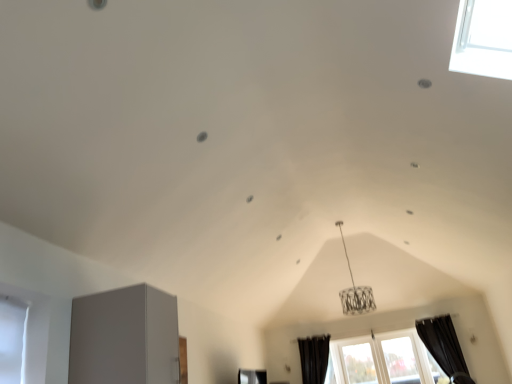
In order to face transparent glass window at lower right, acting as the first window starting from the right, should I rotate leftwards or rightwards?

You should rotate right by 18.556 degrees.

At what (x,y) coordinates should I click in order to perform the action: click on white glass window at lower right, which is counted as the second window, starting from the right. Please return your answer as a coordinate pair (x, y). The width and height of the screenshot is (512, 384). Looking at the image, I should click on (383, 360).

This screenshot has width=512, height=384. Identify the location of transparent glass window at lower right, the second window viewed from the left. (401, 360).

Is black fabric curtain at lower right, the 1th curtain from the right, positioned with its back to transparent glass window at lower right, the second window viewed from the left?

No, black fabric curtain at lower right, the 1th curtain from the right, is not facing the opposite direction of transparent glass window at lower right, the second window viewed from the left.

From a real-world perspective, is black fabric curtain at lower right, the 2th curtain positioned from the left, under transparent glass window at lower right, acting as the first window starting from the right?

Incorrect, from a real-world perspective, black fabric curtain at lower right, the 2th curtain positioned from the left, is higher than transparent glass window at lower right, acting as the first window starting from the right.

Which of these two, black fabric curtain at lower right, the 1th curtain from the right, or transparent glass window at lower right, the second window viewed from the left, stands taller?

Standing taller between the two is black fabric curtain at lower right, the 1th curtain from the right.

Which object is further away from the camera taking this photo, black fabric curtain at lower right, the 1th curtain from the right, or transparent glass window at lower right, acting as the first window starting from the right?

transparent glass window at lower right, acting as the first window starting from the right, is more distant.

Could you measure the distance between transparent glass window at lower right, the second window viewed from the left, and white glass window at lower right, which is the first window from left to right?

transparent glass window at lower right, the second window viewed from the left, and white glass window at lower right, which is the first window from left to right, are 20.13 centimeters apart from each other.

Which is behind, point (389, 353) or point (392, 344)?

The point (392, 344) is behind.

From the image's perspective, is transparent glass window at lower right, the second window viewed from the left, located above or below white glass window at lower right, which is the first window from left to right?

transparent glass window at lower right, the second window viewed from the left, is above white glass window at lower right, which is the first window from left to right.

Are transparent glass window at lower right, the second window viewed from the left, and white glass window at lower right, which is counted as the second window, starting from the right, making contact?

transparent glass window at lower right, the second window viewed from the left, and white glass window at lower right, which is counted as the second window, starting from the right, are not in contact.

Are black fabric curtain at lower center, the 1th curtain when ordered from left to right, and white glass window at lower right, which is the first window from left to right, located far from each other?

No, there isn't a large distance between black fabric curtain at lower center, the 1th curtain when ordered from left to right, and white glass window at lower right, which is the first window from left to right.

From a real-world perspective, starting from the black fabric curtain at lower center, placed as the 2th curtain when sorted from right to left, which window is the 2nd one below it? Please provide its 2D coordinates.

[(383, 360)]

From a real-world perspective, is black fabric curtain at lower center, placed as the 2th curtain when sorted from right to left, positioned over white glass window at lower right, which is the first window from left to right, based on gravity?

Yes, from a real-world perspective, black fabric curtain at lower center, placed as the 2th curtain when sorted from right to left, is over white glass window at lower right, which is the first window from left to right

How many degrees apart are the facing directions of black fabric curtain at lower center, placed as the 2th curtain when sorted from right to left, and white glass window at lower right, which is counted as the second window, starting from the right?

0.728 degrees.

Considering the relative positions of white glass window at lower right, which is the first window from left to right, and transparent glass window at lower right, acting as the first window starting from the right, in the image provided, is white glass window at lower right, which is the first window from left to right, to the left of transparent glass window at lower right, acting as the first window starting from the right, from the viewer's perspective?

Indeed, white glass window at lower right, which is the first window from left to right, is positioned on the left side of transparent glass window at lower right, acting as the first window starting from the right.

Consider the image. From the image's perspective, which one is positioned lower, white glass window at lower right, which is the first window from left to right, or transparent glass window at lower right, the second window viewed from the left?

white glass window at lower right, which is the first window from left to right, from the image's perspective.

Could you measure the distance between white glass window at lower right, which is counted as the second window, starting from the right, and transparent glass window at lower right, the second window viewed from the left?

white glass window at lower right, which is counted as the second window, starting from the right, and transparent glass window at lower right, the second window viewed from the left, are 7.92 inches apart from each other.

Which object is wider, white glass window at lower right, which is the first window from left to right, or transparent glass window at lower right, the second window viewed from the left?

Wider between the two is transparent glass window at lower right, the second window viewed from the left.

Is the depth of white glass window at lower right, which is counted as the second window, starting from the right, greater than that of black fabric curtain at lower center, placed as the 2th curtain when sorted from right to left?

No, white glass window at lower right, which is counted as the second window, starting from the right, is closer to the viewer.

Consider the image. Is white glass window at lower right, which is the first window from left to right, wider than black fabric curtain at lower center, the 1th curtain when ordered from left to right?

No, white glass window at lower right, which is the first window from left to right, is not wider than black fabric curtain at lower center, the 1th curtain when ordered from left to right.

Where is `curtain behind the white glass window at lower right, which is counted as the second window, starting from the right`? curtain behind the white glass window at lower right, which is counted as the second window, starting from the right is located at coordinates (314, 358).

Does white glass window at lower right, which is the first window from left to right, have a smaller size compared to black fabric curtain at lower center, placed as the 2th curtain when sorted from right to left?

No.

From a real-world perspective, is black fabric curtain at lower center, the 1th curtain when ordered from left to right, physically below transparent glass window at lower right, the second window viewed from the left?

No, from a real-world perspective, black fabric curtain at lower center, the 1th curtain when ordered from left to right, is not beneath transparent glass window at lower right, the second window viewed from the left.

You are a GUI agent. You are given a task and a screenshot of the screen. Output one action in this format:
    pyautogui.click(x=<x>, y=<y>)
    Task: Click on the curtain on the left side of transparent glass window at lower right, acting as the first window starting from the right
    Image resolution: width=512 pixels, height=384 pixels.
    Given the screenshot: What is the action you would take?
    pyautogui.click(x=314, y=358)

Is black fabric curtain at lower center, placed as the 2th curtain when sorted from right to left, positioned in front of transparent glass window at lower right, the second window viewed from the left?

That is False.

Looking at this image, how many degrees apart are the facing directions of transparent glass window at lower right, the second window viewed from the left, and black fabric curtain at lower right, the 2th curtain positioned from the left?

They differ by 0.728 degrees in their facing directions.

Can we say transparent glass window at lower right, acting as the first window starting from the right, lies outside black fabric curtain at lower right, the 1th curtain from the right?

transparent glass window at lower right, acting as the first window starting from the right, lies outside black fabric curtain at lower right, the 1th curtain from the right,'s area.

Can you confirm if transparent glass window at lower right, the second window viewed from the left, is thinner than black fabric curtain at lower right, the 2th curtain positioned from the left?

Yes, transparent glass window at lower right, the second window viewed from the left, is thinner than black fabric curtain at lower right, the 2th curtain positioned from the left.

From a real-world perspective, who is located lower, transparent glass window at lower right, the second window viewed from the left, or black fabric curtain at lower right, the 1th curtain from the right?

transparent glass window at lower right, the second window viewed from the left, is physically lower.

This screenshot has height=384, width=512. Identify the location of the 2nd window behind when counting from the black fabric curtain at lower right, the 2th curtain positioned from the left. (401, 360).

The height and width of the screenshot is (384, 512). Identify the location of window in front of the transparent glass window at lower right, the second window viewed from the left. [383, 360].

Based on the photo, based on their spatial positions, is transparent glass window at lower right, the second window viewed from the left, or black fabric curtain at lower right, the 1th curtain from the right, closer to white glass window at lower right, which is counted as the second window, starting from the right?

transparent glass window at lower right, the second window viewed from the left, is positioned closer to the anchor white glass window at lower right, which is counted as the second window, starting from the right.

From the image, which object appears to be nearer to black fabric curtain at lower right, the 2th curtain positioned from the left, transparent glass window at lower right, acting as the first window starting from the right, or black fabric curtain at lower center, placed as the 2th curtain when sorted from right to left?

transparent glass window at lower right, acting as the first window starting from the right, is positioned closer to the anchor black fabric curtain at lower right, the 2th curtain positioned from the left.

Based on their spatial positions, is black fabric curtain at lower center, the 1th curtain when ordered from left to right, or black fabric curtain at lower right, the 1th curtain from the right, further from white glass window at lower right, which is counted as the second window, starting from the right?

black fabric curtain at lower center, the 1th curtain when ordered from left to right, lies further to white glass window at lower right, which is counted as the second window, starting from the right, than the other object.

When comparing their distances from black fabric curtain at lower right, the 2th curtain positioned from the left, does black fabric curtain at lower center, placed as the 2th curtain when sorted from right to left, or transparent glass window at lower right, the second window viewed from the left, seem closer?

transparent glass window at lower right, the second window viewed from the left, lies closer to black fabric curtain at lower right, the 2th curtain positioned from the left, than the other object.

Based on their spatial positions, is white glass window at lower right, which is the first window from left to right, or black fabric curtain at lower right, the 1th curtain from the right, closer to black fabric curtain at lower center, placed as the 2th curtain when sorted from right to left?

white glass window at lower right, which is the first window from left to right, lies closer to black fabric curtain at lower center, placed as the 2th curtain when sorted from right to left, than the other object.

Which object lies further to the anchor point black fabric curtain at lower center, placed as the 2th curtain when sorted from right to left, black fabric curtain at lower right, the 2th curtain positioned from the left, or transparent glass window at lower right, acting as the first window starting from the right?

black fabric curtain at lower right, the 2th curtain positioned from the left, is further to black fabric curtain at lower center, placed as the 2th curtain when sorted from right to left.

Based on the photo, from the image, which object appears to be farther from white glass window at lower right, which is counted as the second window, starting from the right, black fabric curtain at lower right, the 1th curtain from the right, or black fabric curtain at lower center, placed as the 2th curtain when sorted from right to left?

black fabric curtain at lower center, placed as the 2th curtain when sorted from right to left, lies further to white glass window at lower right, which is counted as the second window, starting from the right, than the other object.

Considering their positions, is transparent glass window at lower right, acting as the first window starting from the right, positioned further to black fabric curtain at lower center, placed as the 2th curtain when sorted from right to left, than white glass window at lower right, which is counted as the second window, starting from the right?

transparent glass window at lower right, acting as the first window starting from the right, is further to black fabric curtain at lower center, placed as the 2th curtain when sorted from right to left.

Locate an element on the screen. Image resolution: width=512 pixels, height=384 pixels. window between black fabric curtain at lower center, placed as the 2th curtain when sorted from right to left, and transparent glass window at lower right, acting as the first window starting from the right, in the horizontal direction is located at coordinates (383, 360).

Where is `window located between white glass window at lower right, which is counted as the second window, starting from the right, and black fabric curtain at lower right, the 2th curtain positioned from the left, in the left-right direction`? The width and height of the screenshot is (512, 384). window located between white glass window at lower right, which is counted as the second window, starting from the right, and black fabric curtain at lower right, the 2th curtain positioned from the left, in the left-right direction is located at coordinates (401, 360).